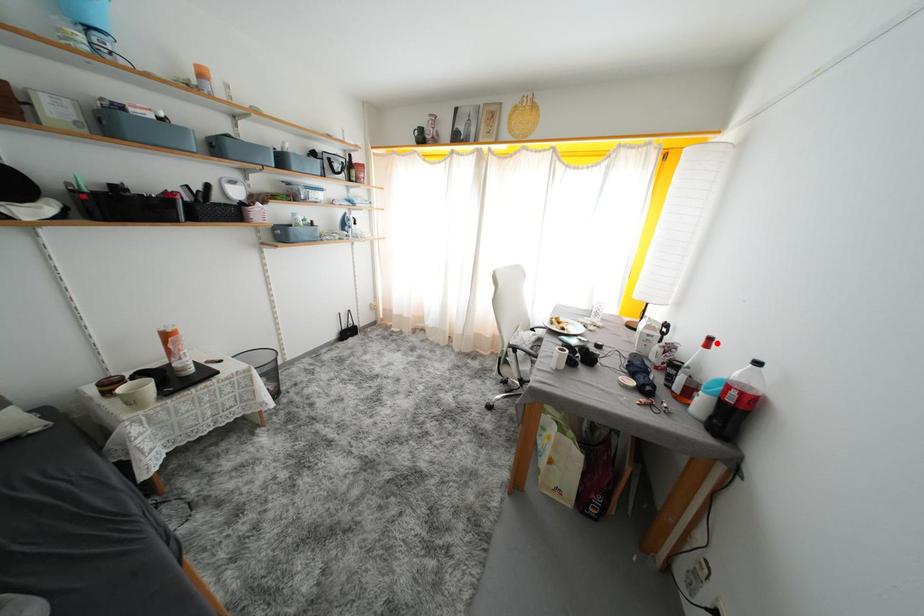
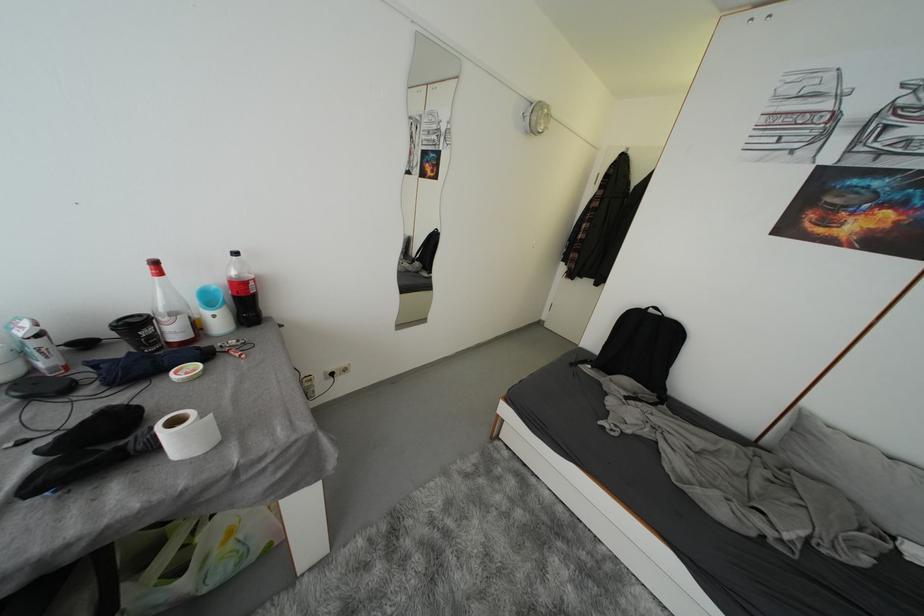
In the second image, find the point that corresponds to the highlighted location in the first image.

(162, 267)